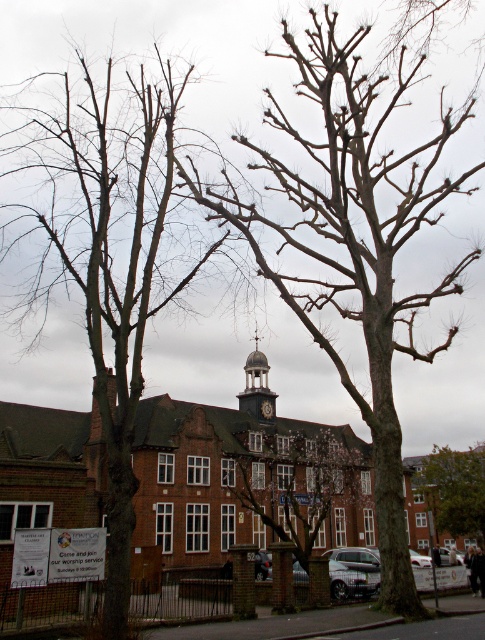
Is point (43, 179) farther from viewer compared to point (268, 413)?

Yes.

Does smooth bark tree at left have a greater width compared to dark brown wooden clock at center?

Yes, smooth bark tree at left is wider than dark brown wooden clock at center.

What are the coordinates of `smooth bark tree at left` in the screenshot? It's located at (107, 252).

Does point (323, 289) come in front of point (222, 474)?

Yes, it is.

Does bare wood tree at center have a lesser width compared to brown textured tree at center?

In fact, bare wood tree at center might be wider than brown textured tree at center.

Between point (385, 317) and point (304, 515), which one is positioned behind?

The point (304, 515) is behind.

Locate an element on the screen. This screenshot has width=485, height=640. bare wood tree at center is located at coordinates (350, 234).

Does brown textured tree at center have a greater height compared to dark gray stone clock tower at center?

Correct, brown textured tree at center is much taller as dark gray stone clock tower at center.

Is point (341, 502) less distant than point (252, 380)?

Yes, it is in front of point (252, 380).

What do you see at coordinates (304, 486) in the screenshot?
I see `brown textured tree at center` at bounding box center [304, 486].

I want to click on brown textured tree at center, so click(304, 486).